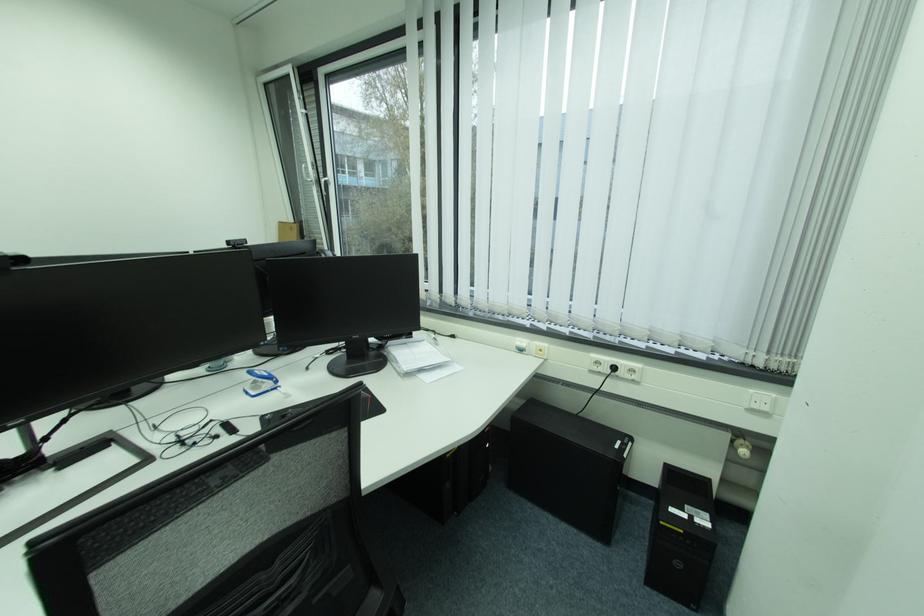
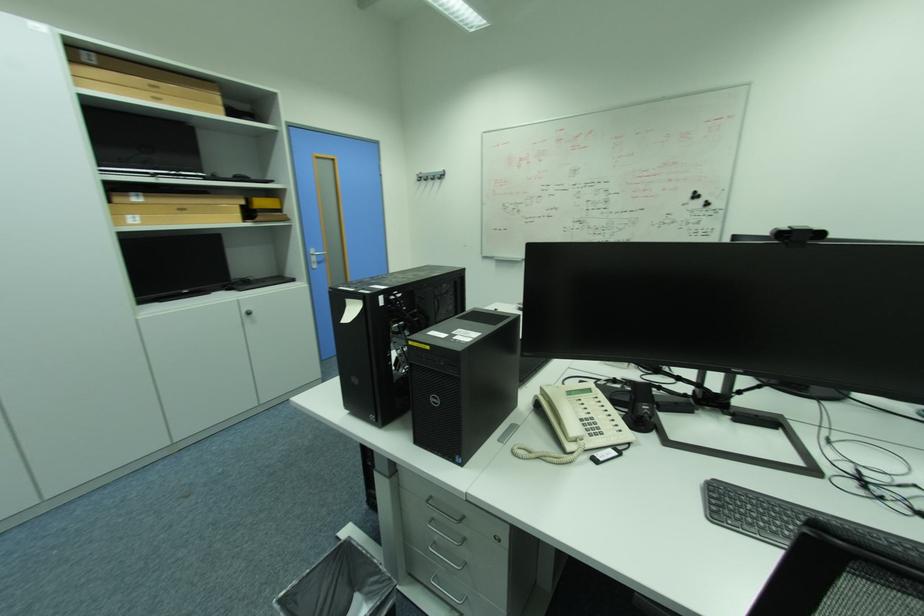
How did the camera likely rotate?

The camera rotated toward left-down.